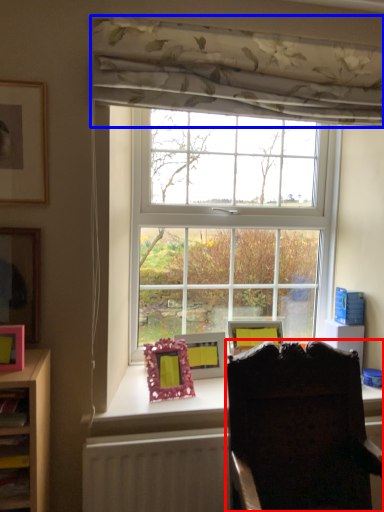
Question: Among these objects, which one is farthest to the camera, chair (highlighted by a red box) or curtain (highlighted by a blue box)?

Choices:
 (A) chair
 (B) curtain

Answer: (B)